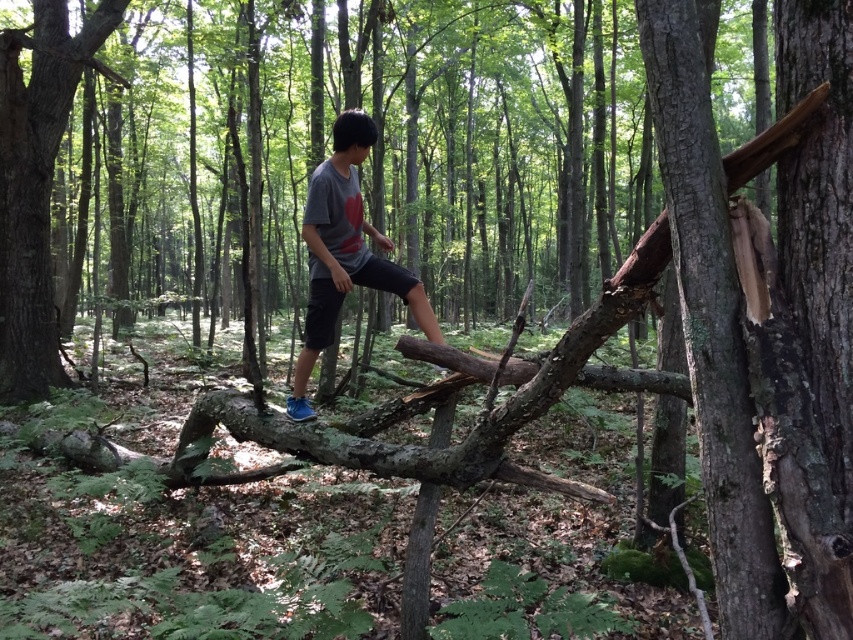
Is point (766, 504) closer to viewer compared to point (344, 129)?

That is True.

Does smooth brown tree trunk at center right have a larger size compared to gray cotton t-shirt at center?

No.

The width and height of the screenshot is (853, 640). What are the coordinates of `smooth brown tree trunk at center right` in the screenshot? It's located at (711, 324).

Image resolution: width=853 pixels, height=640 pixels. I want to click on smooth brown tree trunk at center right, so click(x=711, y=324).

Based on the photo, is smooth brown tree trunk at center right thinner than smooth brown tree trunk at left?

Yes, smooth brown tree trunk at center right is thinner than smooth brown tree trunk at left.

Does smooth brown tree trunk at center right have a greater height compared to smooth brown tree trunk at left?

No.

At what (x,y) coordinates should I click in order to perform the action: click on smooth brown tree trunk at center right. Please return your answer as a coordinate pair (x, y). Looking at the image, I should click on (711, 324).

Can you confirm if smooth brown tree trunk at left is bigger than gray cotton t-shirt at center?

Yes.

Between smooth brown tree trunk at left and gray cotton t-shirt at center, which one is positioned higher?

smooth brown tree trunk at left is above.

Where is `smooth brown tree trunk at left`? This screenshot has width=853, height=640. smooth brown tree trunk at left is located at coordinates (36, 182).